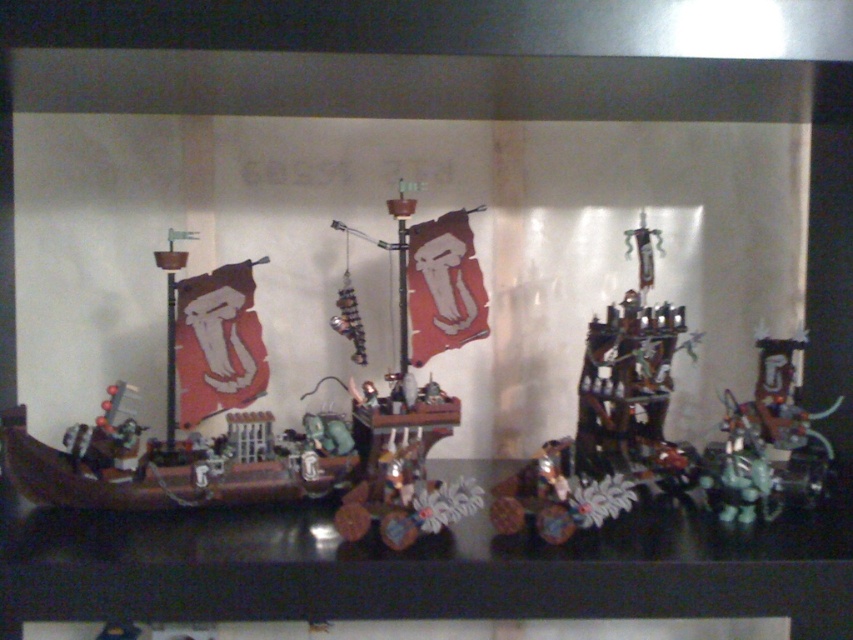
Question: Which of the following is the farthest from the observer?

Choices:
 (A) shiny dark brown ship at center-right
 (B) metallic silver ship at center

Answer: (A)

Question: From the image, what is the correct spatial relationship of metallic silver ship at center in relation to shiny dark brown ship at center-right?

Choices:
 (A) above
 (B) below

Answer: (B)

Question: Which point appears closest to the camera in this image?

Choices:
 (A) (393, 531)
 (B) (683, 316)

Answer: (A)

Question: Is metallic silver ship at center smaller than shiny dark brown ship at center-right?

Choices:
 (A) no
 (B) yes

Answer: (A)

Question: Which point is farther from the camera taking this photo?

Choices:
 (A) (648, 419)
 (B) (444, 432)

Answer: (A)

Question: Does metallic silver ship at center appear under shiny dark brown ship at center-right?

Choices:
 (A) yes
 (B) no

Answer: (A)